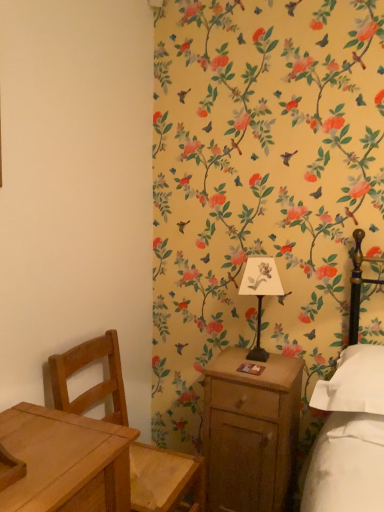
Question: Is metallic black bedside lamp at center-right outside light brown wooden chair at left?

Choices:
 (A) no
 (B) yes

Answer: (B)

Question: From the image's perspective, would you say metallic black bedside lamp at center-right is positioned over light brown wooden chair at left?

Choices:
 (A) no
 (B) yes

Answer: (B)

Question: Considering the relative sizes of metallic black bedside lamp at center-right and light brown wooden chair at left in the image provided, is metallic black bedside lamp at center-right wider than light brown wooden chair at left?

Choices:
 (A) yes
 (B) no

Answer: (B)

Question: Is metallic black bedside lamp at center-right shorter than light brown wooden chair at left?

Choices:
 (A) no
 (B) yes

Answer: (B)

Question: Is the surface of metallic black bedside lamp at center-right in direct contact with light brown wooden chair at left?

Choices:
 (A) no
 (B) yes

Answer: (A)

Question: From a real-world perspective, is metallic black bedside lamp at center-right physically below light brown wooden chair at left?

Choices:
 (A) no
 (B) yes

Answer: (A)

Question: Is light brown wooden chair at left to the right of metallic black bedside lamp at center-right from the viewer's perspective?

Choices:
 (A) no
 (B) yes

Answer: (A)

Question: Considering the relative sizes of light brown wooden chair at left and metallic black bedside lamp at center-right in the image provided, is light brown wooden chair at left wider than metallic black bedside lamp at center-right?

Choices:
 (A) yes
 (B) no

Answer: (A)

Question: Is light brown wooden chair at left shorter than metallic black bedside lamp at center-right?

Choices:
 (A) yes
 (B) no

Answer: (B)

Question: Is light brown wooden chair at left bigger than metallic black bedside lamp at center-right?

Choices:
 (A) no
 (B) yes

Answer: (B)

Question: Is light brown wooden chair at left positioned before metallic black bedside lamp at center-right?

Choices:
 (A) yes
 (B) no

Answer: (A)

Question: From the image's perspective, is light brown wooden chair at left on top of metallic black bedside lamp at center-right?

Choices:
 (A) no
 (B) yes

Answer: (A)

Question: From a real-world perspective, is wooden nightstand at right below metallic black bedside lamp at center-right?

Choices:
 (A) yes
 (B) no

Answer: (A)